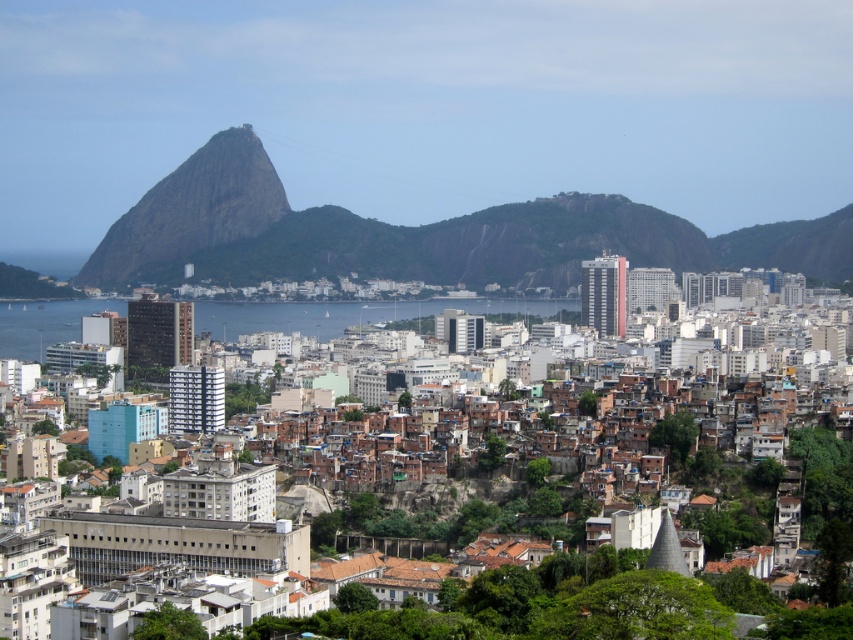
Is rustic granite mountain at center positioned in front of brown rock formation at upper left?

Yes, rustic granite mountain at center is closer to the viewer.

Can you confirm if rustic granite mountain at center is positioned above brown rock formation at upper left?

Correct, rustic granite mountain at center is located above brown rock formation at upper left.

Describe the element at coordinates (421, 234) in the screenshot. The image size is (853, 640). I see `rustic granite mountain at center` at that location.

The image size is (853, 640). What are the coordinates of `rustic granite mountain at center` in the screenshot? It's located at (421, 234).

Who is positioned more to the left, rustic granite mountain at center or clear blue water at center?

clear blue water at center

Describe the element at coordinates (421, 234) in the screenshot. This screenshot has width=853, height=640. I see `rustic granite mountain at center` at that location.

Which is behind, point (558, 268) or point (54, 324)?

The point (54, 324) is more distant.

The width and height of the screenshot is (853, 640). In order to click on rustic granite mountain at center in this screenshot , I will do `click(421, 234)`.

Can you confirm if brown rock formation at upper left is positioned to the left of clear blue water at center?

→ Yes, brown rock formation at upper left is to the left of clear blue water at center.

Does brown rock formation at upper left appear under clear blue water at center?

No, brown rock formation at upper left is not below clear blue water at center.

Is point (143, 264) positioned after point (65, 308)?

No, (143, 264) is in front of (65, 308).

Where is `brown rock formation at upper left`? This screenshot has width=853, height=640. brown rock formation at upper left is located at coordinates (193, 209).